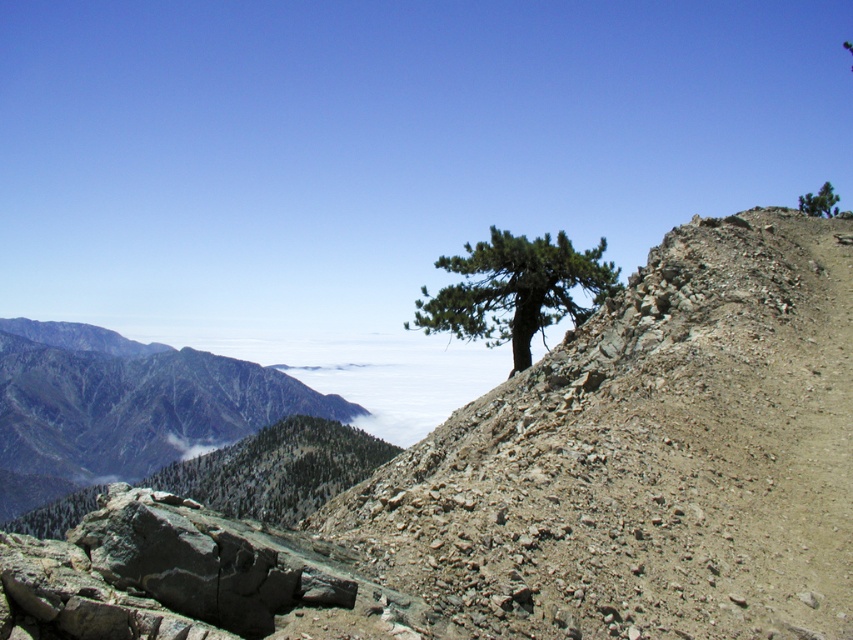
Is green textured tree at upper center to the left of green matte tree at upper right from the viewer's perspective?

Indeed, green textured tree at upper center is positioned on the left side of green matte tree at upper right.

Where is `green textured tree at upper center`? green textured tree at upper center is located at coordinates (515, 289).

What are the coordinates of `green textured tree at upper center` in the screenshot? It's located at (515, 289).

Who is shorter, gray rocky mountain at left or green matte tree at upper right?

With less height is gray rocky mountain at left.

Describe the element at coordinates (125, 413) in the screenshot. I see `gray rocky mountain at left` at that location.

Measure the distance between point (136, 428) and camera.

Point (136, 428) and camera are 255.38 meters apart from each other.

This screenshot has width=853, height=640. I want to click on gray rocky mountain at left, so click(125, 413).

Can you confirm if gray rocky mountain at left is positioned to the left of green textured tree at upper center?

Yes, gray rocky mountain at left is to the left of green textured tree at upper center.

Between gray rocky mountain at left and green textured tree at upper center, which one appears on the left side from the viewer's perspective?

Positioned to the left is gray rocky mountain at left.

Describe the element at coordinates (125, 413) in the screenshot. The height and width of the screenshot is (640, 853). I see `gray rocky mountain at left` at that location.

Identify the location of gray rocky mountain at left. coord(125,413).